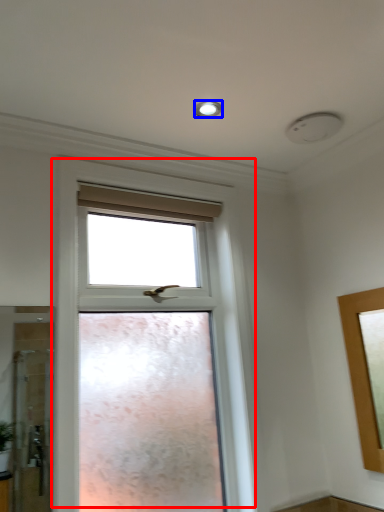
Question: Which object appears closest to the camera in this image, window (highlighted by a red box) or lighting (highlighted by a blue box)?

Choices:
 (A) window
 (B) lighting

Answer: (A)